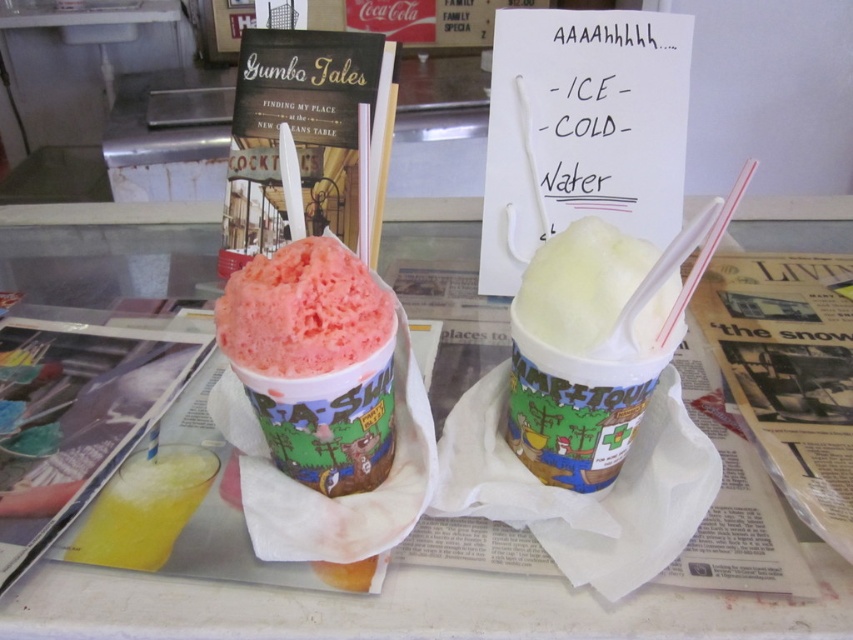
You are a customer at an ice shop and want to choose the dessert that is closer to you. Which one should you pick between the matte pink shaved ice at center and the white creamy milkshake at center?

The matte pink shaved ice at center is closer to you than the white creamy milkshake at center, so you should pick the matte pink shaved ice at center.

You are at a dessert shop and want to choose the taller drink between the matte pink shaved ice at center and the white creamy milkshake at center. Which one should you choose?

The white creamy milkshake at center is taller than the matte pink shaved ice at center, so you should choose the white creamy milkshake at center.